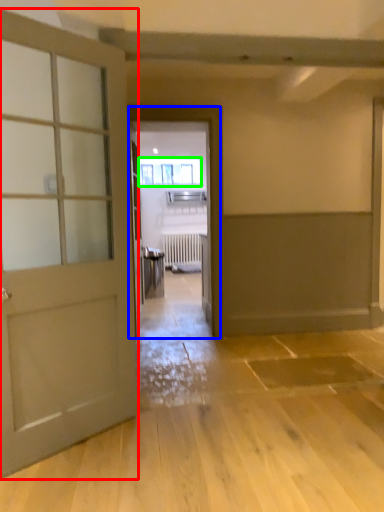
Question: Estimate the real-world distances between objects in this image. Which object is closer to door (highlighted by a red box), elevator (highlighted by a blue box) or window (highlighted by a green box)?

Choices:
 (A) elevator
 (B) window

Answer: (A)